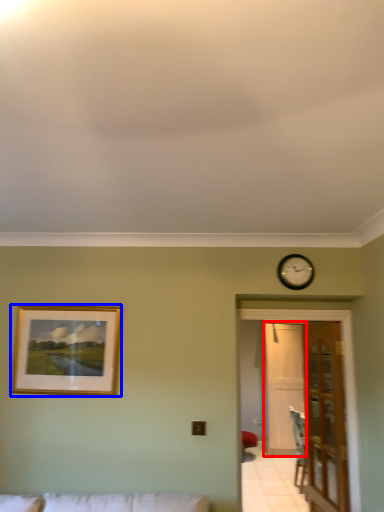
Question: Which of the following is the farthest to the observer, glass door (highlighted by a red box) or picture frame (highlighted by a blue box)?

Choices:
 (A) glass door
 (B) picture frame

Answer: (A)